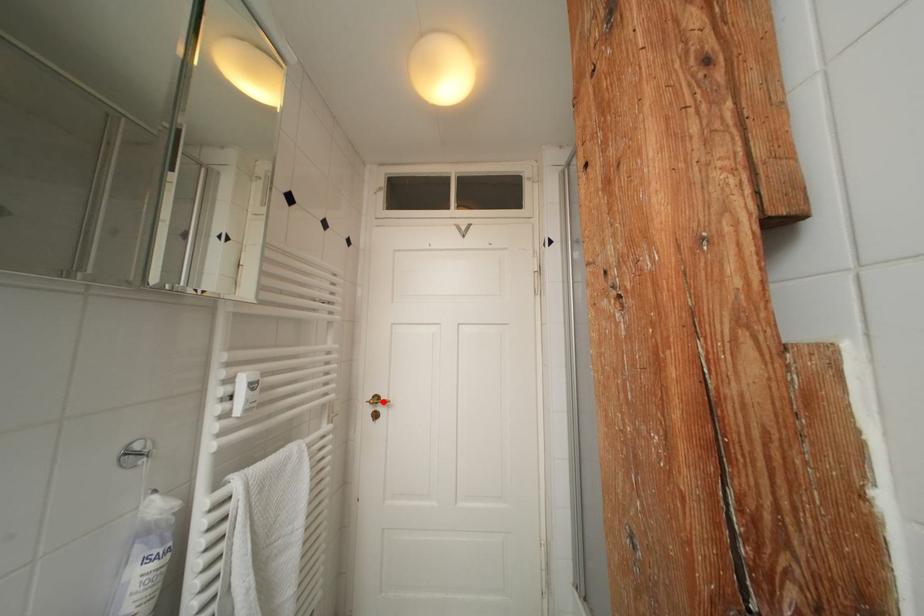
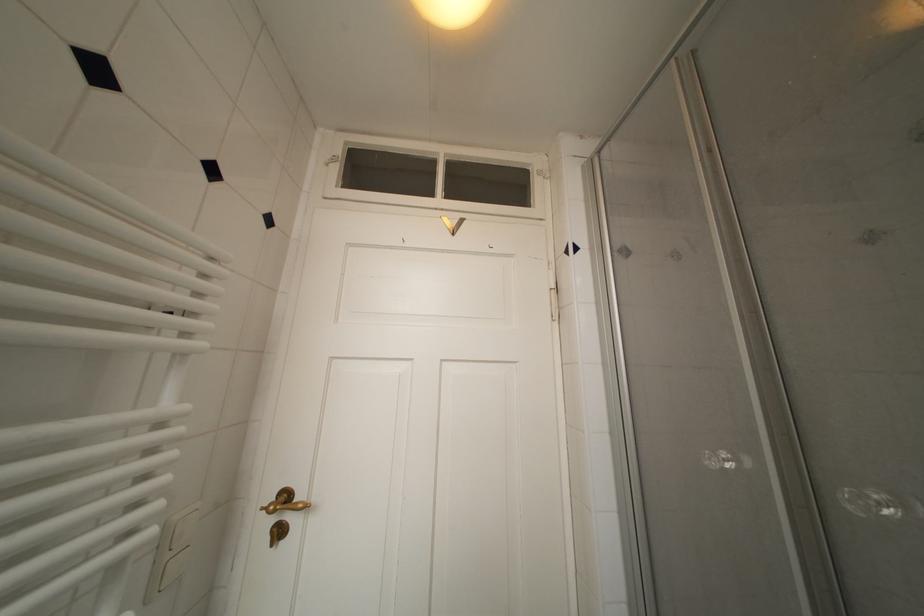
The point at the highlighted location is marked in the first image. Where is the corresponding point in the second image?

(293, 500)